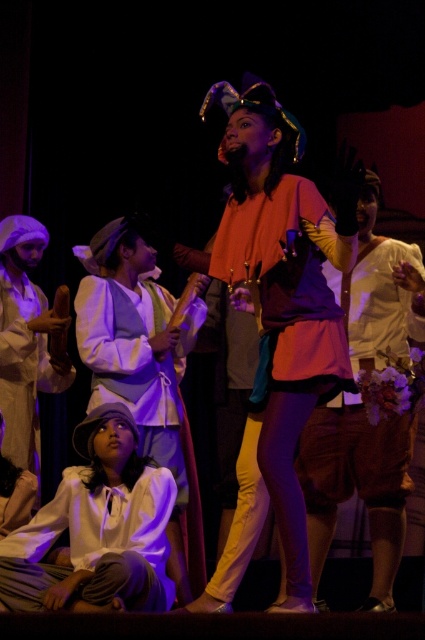
Does matte orange blouse at center appear under white cotton shirt at lower left?

Actually, matte orange blouse at center is above white cotton shirt at lower left.

Which is behind, point (342, 236) or point (82, 476)?

The point (82, 476) is more distant.

The image size is (425, 640). In order to click on matte orange blouse at center in this screenshot , I will do `click(286, 349)`.

What do you see at coordinates (142, 372) in the screenshot?
I see `matte white blouse at center` at bounding box center [142, 372].

Is point (96, 397) more distant than point (53, 332)?

No, it is not.

Which is behind, point (144, 381) or point (16, 260)?

The point (16, 260) is more distant.

Identify the location of matte white blouse at center. (142, 372).

Consider the image. Does matte orange shirt at center have a greater width compared to white cotton shirt at lower left?

No.

Which of these two, matte orange shirt at center or white cotton shirt at lower left, stands shorter?

With less height is white cotton shirt at lower left.

Who is more distant from viewer, (367,285) or (105,508)?

Point (367,285)

The image size is (425, 640). Find the location of `matte orange shirt at center`. matte orange shirt at center is located at coordinates (357, 484).